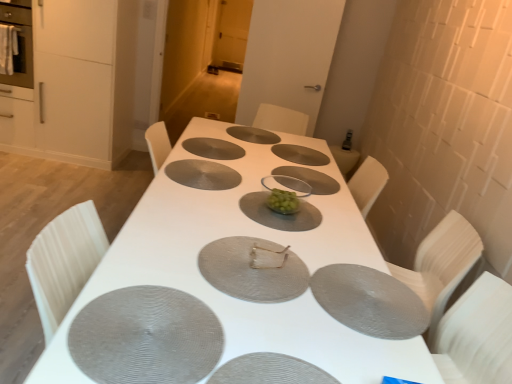
Image resolution: width=512 pixels, height=384 pixels. What are the coordinates of `free space that is to the left of matte gray pizza pan at center, which is counted as the 7th pizza pan, starting from the front` in the screenshot? It's located at (252, 142).